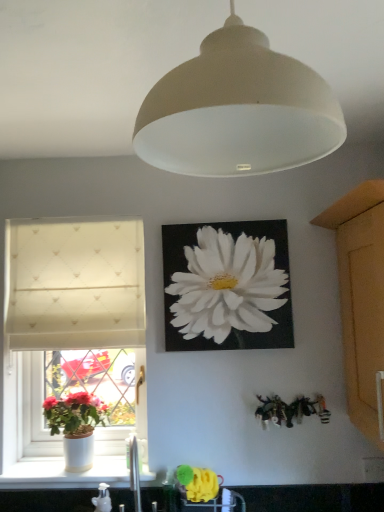
You are a GUI agent. You are given a task and a screenshot of the screen. Output one action in this format:
    pyautogui.click(x=<x>, y=<y>)
    Task: Click on the empty space that is ontop of white ceramic vase at lower left (from a real-world perspective)
    Image resolution: width=384 pixels, height=512 pixels.
    Given the screenshot: What is the action you would take?
    pyautogui.click(x=71, y=467)